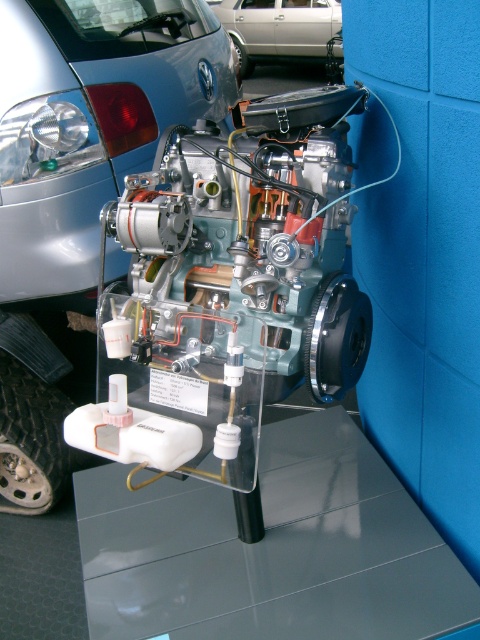
Question: In this image, where is satin silver engine at center located relative to silver metallic car at upper center?

Choices:
 (A) right
 (B) left

Answer: (B)

Question: Is satin silver engine at center closer to the viewer compared to silver metallic car at upper center?

Choices:
 (A) no
 (B) yes

Answer: (B)

Question: Which point is closer to the camera taking this photo?

Choices:
 (A) (80, 65)
 (B) (312, 45)

Answer: (A)

Question: Which point is farther to the camera?

Choices:
 (A) silver metallic car at upper center
 (B) satin silver engine at center

Answer: (A)

Question: Observing the image, what is the correct spatial positioning of satin silver engine at center in reference to silver metallic car at upper center?

Choices:
 (A) above
 (B) below

Answer: (B)